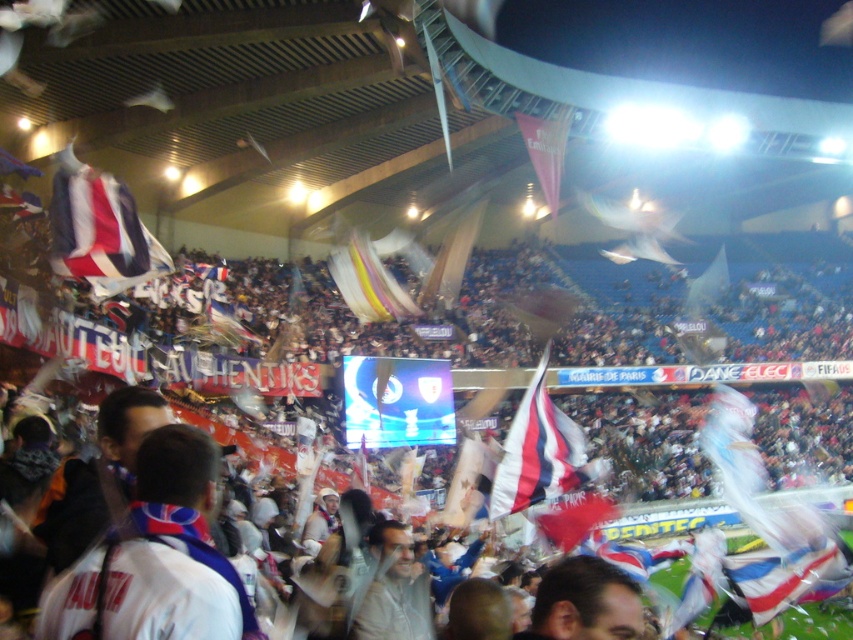
Question: Which object is the closest to the white fabric head at center?

Choices:
 (A) translucent plastic flag at center
 (B) white fabric flag at center
 (C) matte pink flag at upper center

Answer: (B)

Question: Which of the following is the closest to the observer?

Choices:
 (A) matte pink flag at upper center
 (B) translucent plastic flag at center
 (C) white fabric flag at center
 (D) white fabric scarf at lower left

Answer: (D)

Question: Can you confirm if white fabric flag at center is thinner than white fabric head at center?

Choices:
 (A) yes
 (B) no

Answer: (B)

Question: Does translucent plastic flag at center appear over matte pink flag at upper center?

Choices:
 (A) no
 (B) yes

Answer: (A)

Question: Based on their relative distances, which object is farther from the translucent plastic flag at center?

Choices:
 (A) matte pink flag at upper center
 (B) white fabric scarf at lower left
 (C) white fabric head at center

Answer: (B)

Question: Is white fabric scarf at lower left closer to the viewer compared to white fabric flag at center?

Choices:
 (A) yes
 (B) no

Answer: (A)